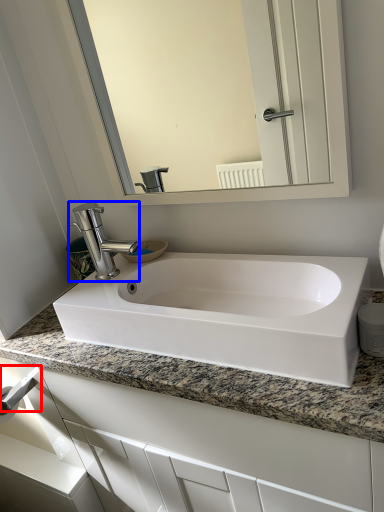
Question: Among these objects, which one is farthest to the camera, towel bar (highlighted by a red box) or tap (highlighted by a blue box)?

Choices:
 (A) towel bar
 (B) tap

Answer: (A)